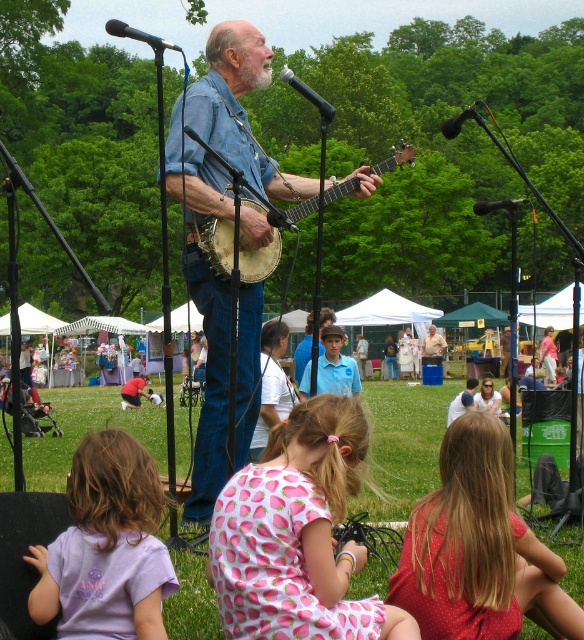
You are standing in the park and want to approach the denim shirt at center to ask the performer a question. If you walk straight towards it, how far will you have to walk?

The denim shirt at center is 6.29 meters away from the viewer, so you will have to walk 6.29 meters to reach it.

You are a photographer taking pictures of the children in the scene. You want to capture both the pink fabric dress at lower center and the polka dot fabric dress at lower right in a single shot. Which child should you focus on first to ensure both are in focus?

You should focus on the pink fabric dress at lower center first because it is closer to the viewer than the polka dot fabric dress at lower right, ensuring both will be in focus when using depth of field.

You are a photographer at the park and need to decide which dress to focus on for a closeup shot. Since the pink fabric dress at lower center and the polka dot fabric dress at lower right are both in the frame, which one would you choose if you want to capture more details of the dress fabric?

The pink fabric dress at lower center is bigger than the polka dot fabric dress at lower right, so choosing the pink fabric dress at lower center would allow capturing more details of the dress fabric.